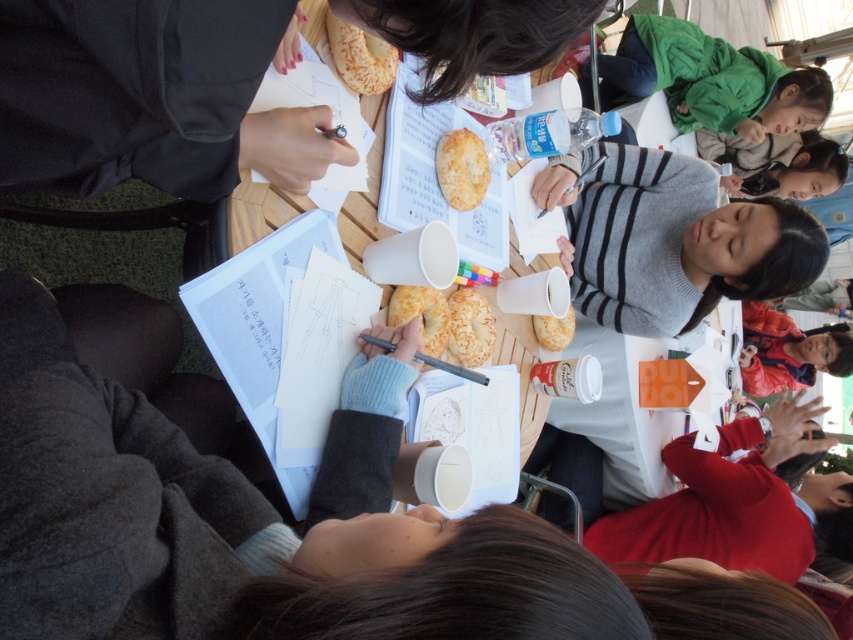
You are part of the group at the table. You need to place a small notebook between the smooth gray sweater at center and the golden brown bread at center. Which object should you place it closer to so that it doesn

The smooth gray sweater at center is taller than the golden brown bread at center. To place the notebook between them, you should position it closer to the golden brown bread at center to ensure stability and avoid obstruction by the taller sweater.

You are part of a group working at the table and you want to pass the golden crumbly pastry at center to the person on your right. Which direction should you move it relative to the golden brown bread at center?

The golden crumbly pastry at center is to the left of the golden brown bread at center, so you should move it to the right towards the golden brown bread at center to pass it to the person on your right.